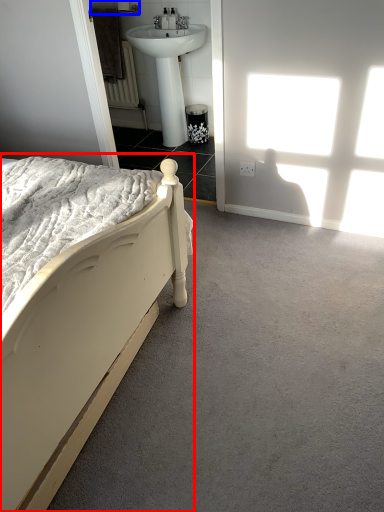
Question: Which of the following is the farthest to the observer, bed (highlighted by a red box) or towel bar (highlighted by a blue box)?

Choices:
 (A) bed
 (B) towel bar

Answer: (B)